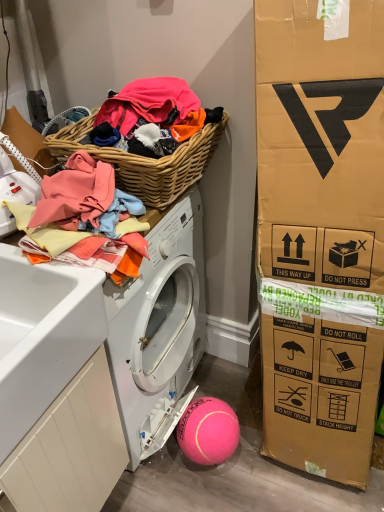
Question: Is soft cotton towels at upper left at the back of white wood drawer at lower left?

Choices:
 (A) yes
 (B) no

Answer: (B)

Question: Is white wood drawer at lower left in front of soft cotton towels at upper left?

Choices:
 (A) no
 (B) yes

Answer: (B)

Question: From a real-world perspective, is white wood drawer at lower left below soft cotton towels at upper left?

Choices:
 (A) yes
 (B) no

Answer: (A)

Question: From a real-world perspective, does white wood drawer at lower left stand above soft cotton towels at upper left?

Choices:
 (A) yes
 (B) no

Answer: (B)

Question: Does white wood drawer at lower left have a smaller size compared to soft cotton towels at upper left?

Choices:
 (A) no
 (B) yes

Answer: (A)

Question: Does white wood drawer at lower left turn towards soft cotton towels at upper left?

Choices:
 (A) yes
 (B) no

Answer: (B)

Question: From the image's perspective, is white matte washer at left under soft cotton towels at upper left?

Choices:
 (A) no
 (B) yes

Answer: (A)

Question: Is white matte washer at left looking in the opposite direction of soft cotton towels at upper left?

Choices:
 (A) no
 (B) yes

Answer: (A)

Question: Could you tell me if white matte washer at left is facing soft cotton towels at upper left?

Choices:
 (A) yes
 (B) no

Answer: (A)

Question: From the image's perspective, is white matte washer at left on top of soft cotton towels at upper left?

Choices:
 (A) no
 (B) yes

Answer: (B)

Question: Would you say white matte washer at left contains soft cotton towels at upper left?

Choices:
 (A) no
 (B) yes

Answer: (A)

Question: Considering the relative sizes of white matte washer at left and soft cotton towels at upper left in the image provided, is white matte washer at left bigger than soft cotton towels at upper left?

Choices:
 (A) yes
 (B) no

Answer: (B)

Question: Is woven wood picnic basket at upper left oriented away from white matte washer at left?

Choices:
 (A) no
 (B) yes

Answer: (A)